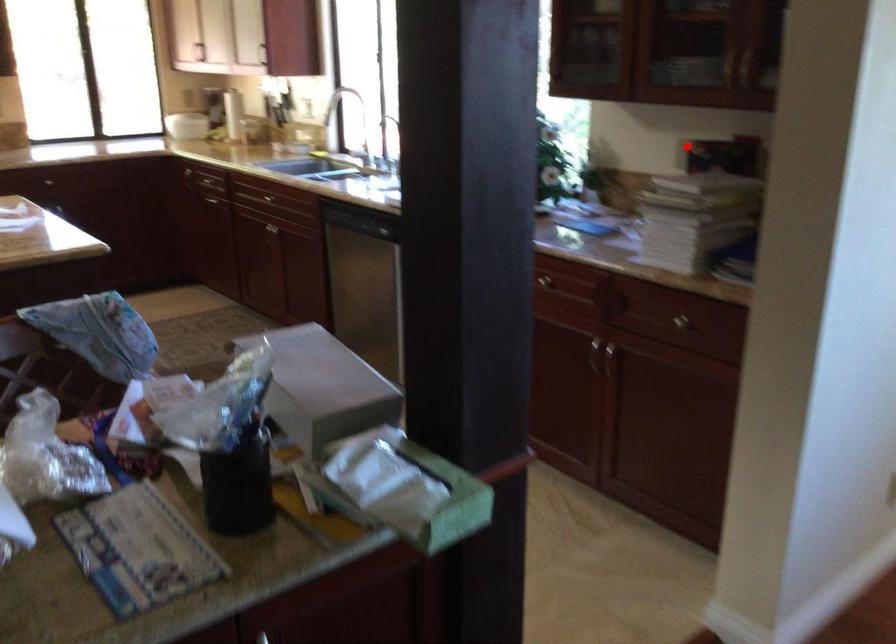
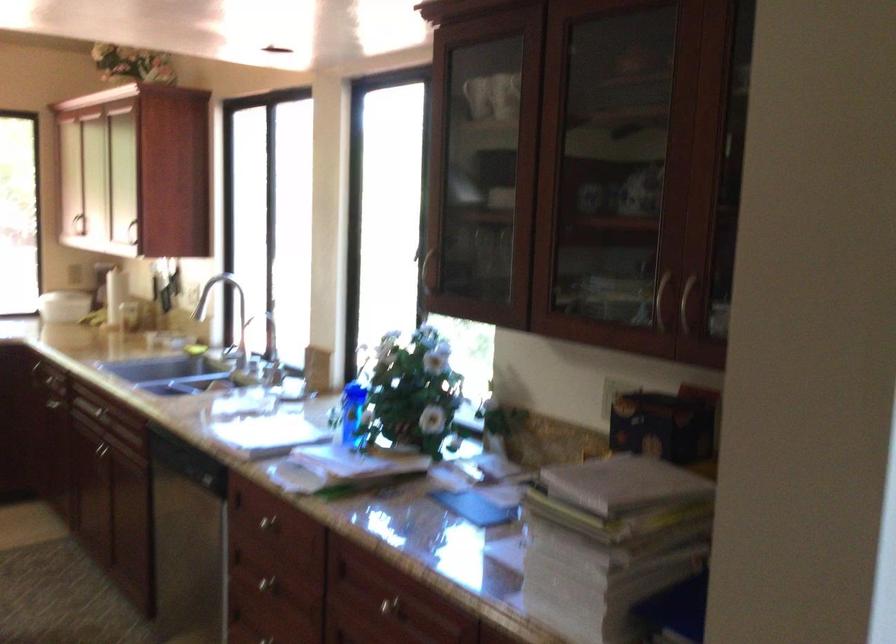
In the second image, find the point that corresponds to the highlighted location in the first image.

(614, 393)